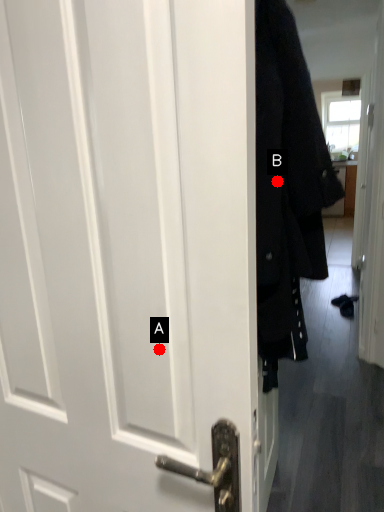
Question: Two points are circled on the image, labeled by A and B beside each circle. Which point is closer to the camera taking this photo?

Choices:
 (A) A is closer
 (B) B is closer

Answer: (A)